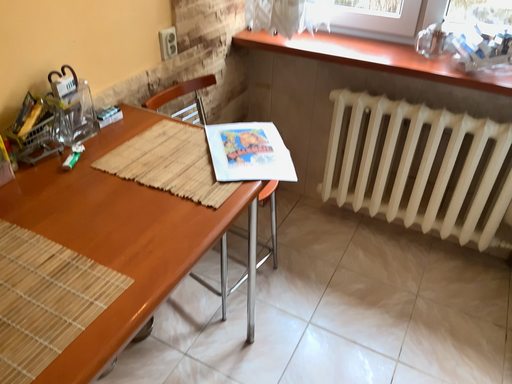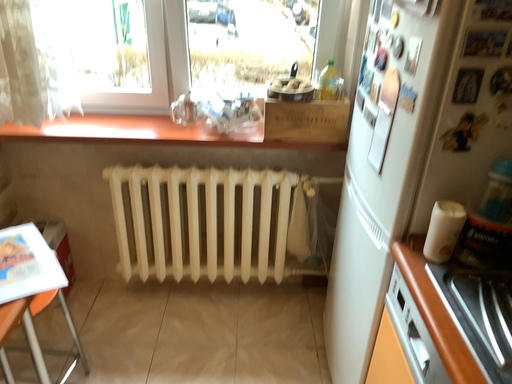
Question: Which way did the camera rotate in the video?

Choices:
 (A) rotated upward
 (B) rotated downward

Answer: (A)